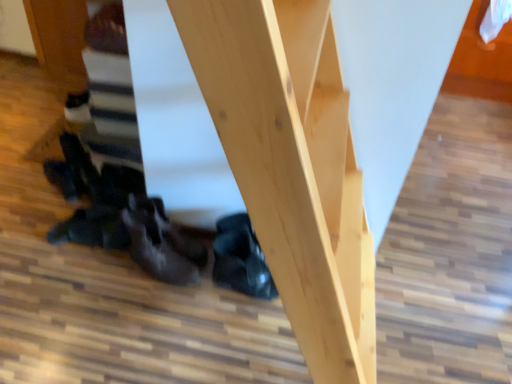
Question: In the image, is dark brown leather shoe at center, positioned as the first leather shoe in left-to-right order, positioned in front of or behind black leather shoe at lower center, which is the 1th leather shoe in right-to-left order?

Choices:
 (A) behind
 (B) front

Answer: (B)

Question: Considering the relative positions of dark brown leather shoe at center, positioned as the first leather shoe in left-to-right order, and black leather shoe at lower center, the second leather shoe viewed from the left, in the image provided, is dark brown leather shoe at center, positioned as the first leather shoe in left-to-right order, to the left or to the right of black leather shoe at lower center, the second leather shoe viewed from the left,?

Choices:
 (A) left
 (B) right

Answer: (A)

Question: In terms of width, does dark brown leather shoe at center, positioned as the first leather shoe in left-to-right order, look wider or thinner when compared to black leather shoe at lower center, which is the 1th leather shoe in right-to-left order?

Choices:
 (A) wide
 (B) thin

Answer: (A)

Question: Based on their positions, is black leather shoe at lower center, which is the 1th leather shoe in right-to-left order, located to the left or right of dark brown leather shoe at center, positioned as the first leather shoe in left-to-right order?

Choices:
 (A) left
 (B) right

Answer: (B)

Question: Is black leather shoe at lower center, the second leather shoe viewed from the left, taller or shorter than dark brown leather shoe at center, positioned as the first leather shoe in left-to-right order?

Choices:
 (A) tall
 (B) short

Answer: (B)

Question: Is point (261, 253) closer or farther from the camera than point (184, 264)?

Choices:
 (A) farther
 (B) closer

Answer: (B)

Question: From a real-world perspective, relative to dark brown leather shoe at center, the 2th leather shoe in the right-to-left sequence, is black leather shoe at lower center, which is the 1th leather shoe in right-to-left order, vertically above or below?

Choices:
 (A) above
 (B) below

Answer: (B)